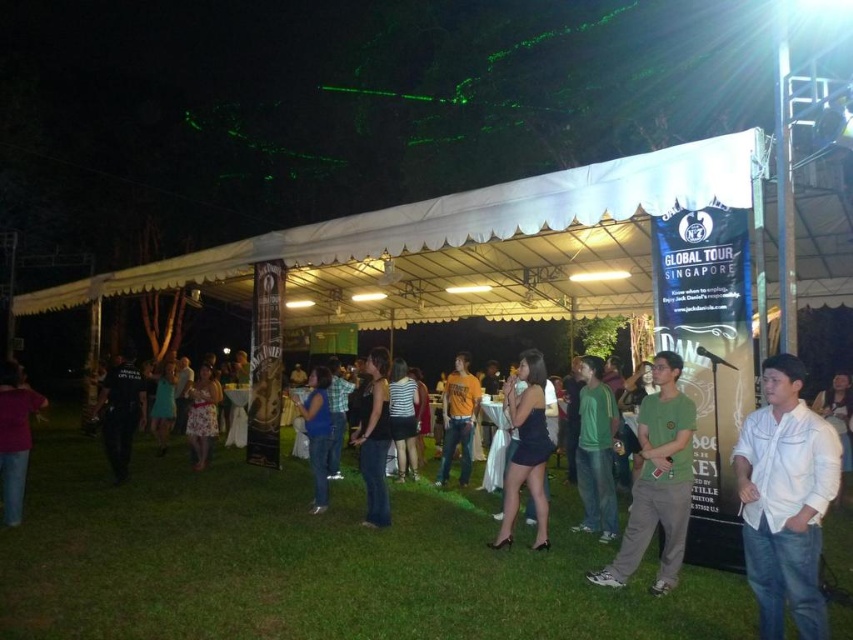
Question: Does dress floral at center appear on the left side of light blue dress at center?

Choices:
 (A) yes
 (B) no

Answer: (B)

Question: Which of these objects is positioned closest to the light blue dress at center?

Choices:
 (A) green cotton shirt at center
 (B) denim jeans at center
 (C) striped fabric dress at center

Answer: (C)

Question: From the image, what is the correct spatial relationship of green matte shirt at center in relation to striped fabric dress at center?

Choices:
 (A) below
 (B) above

Answer: (B)

Question: Is matte pink shirt at lower left positioned at the back of striped fabric dress at center?

Choices:
 (A) yes
 (B) no

Answer: (B)

Question: Which point is closer to the camera taking this photo?

Choices:
 (A) (38, 394)
 (B) (654, 378)

Answer: (B)

Question: Estimate the real-world distances between objects in this image. Which object is closer to the denim jeans at center?

Choices:
 (A) orange cotton shirt at center
 (B) dark blue uniform at lower left
 (C) matte pink shirt at lower left
 (D) striped fabric dress at center

Answer: (D)